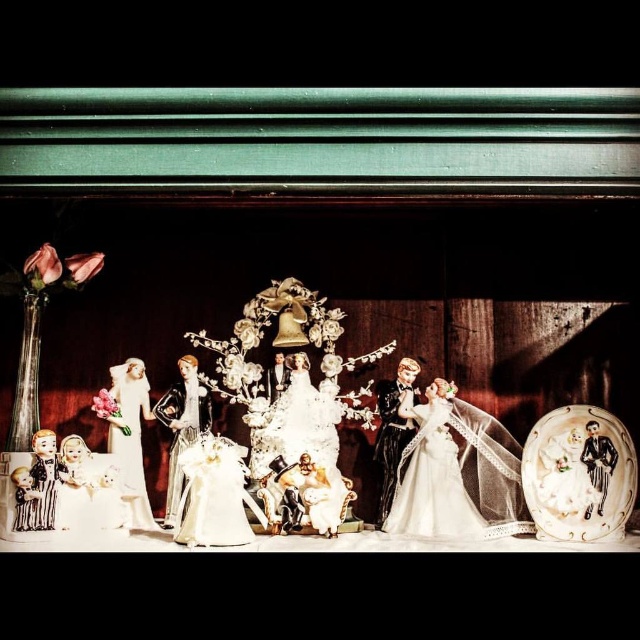
Does point (461, 486) come in front of point (120, 364)?

That is True.

Between point (461, 529) and point (140, 477), which one is positioned in front?

Point (461, 529) is more forward.

Describe the element at coordinates (432, 474) in the screenshot. I see `matte white dress at center` at that location.

Where is `matte white dress at center`? The width and height of the screenshot is (640, 640). matte white dress at center is located at coordinates (432, 474).